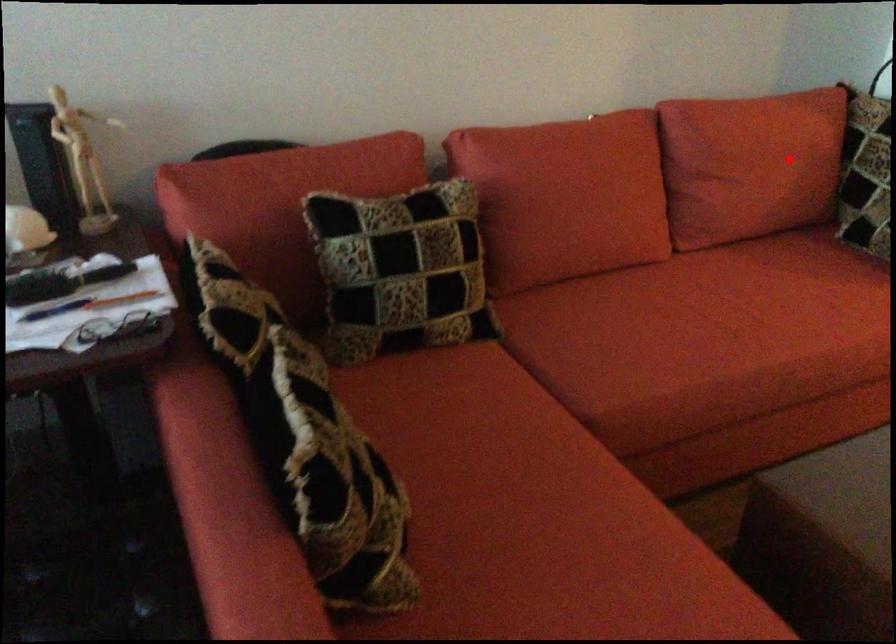
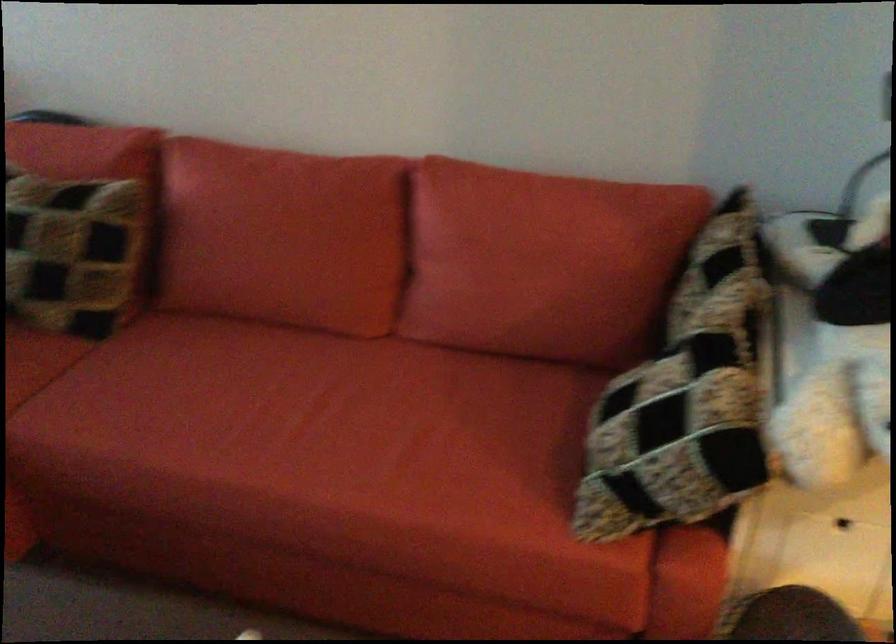
Where in the second image is the point corresponding to the highlighted location from the first image?

(538, 270)